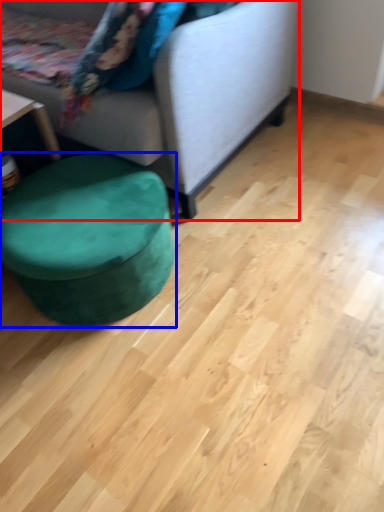
Question: Among these objects, which one is nearest to the camera, studio couch (highlighted by a red box) or music stool (highlighted by a blue box)?

Choices:
 (A) studio couch
 (B) music stool

Answer: (A)